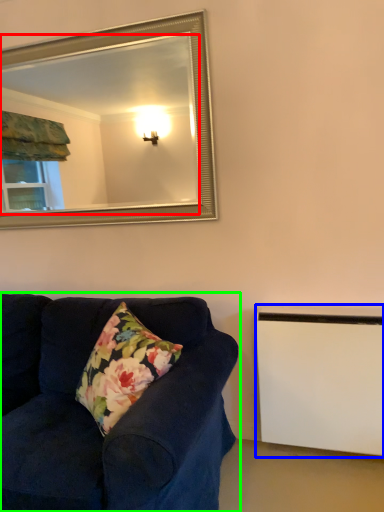
Question: Estimate the real-world distances between objects in this image. Which object is farther from mirror (highlighted by a red box), radiator (highlighted by a blue box) or studio couch (highlighted by a green box)?

Choices:
 (A) radiator
 (B) studio couch

Answer: (A)